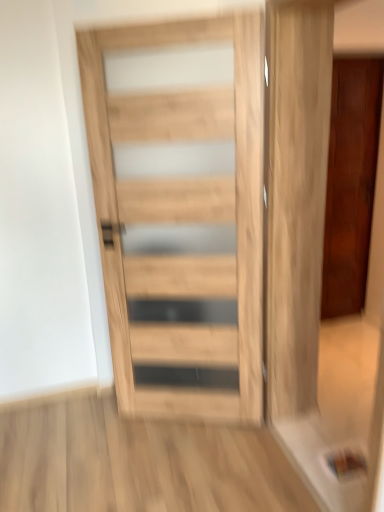
At what (x,y) coordinates should I click in order to perform the action: click on vacant space underneath natural wood door at center, the first door in the left-to-right sequence (from a real-world perspective). Please return your answer as a coordinate pair (x, y). This screenshot has width=384, height=512. Looking at the image, I should click on (190, 419).